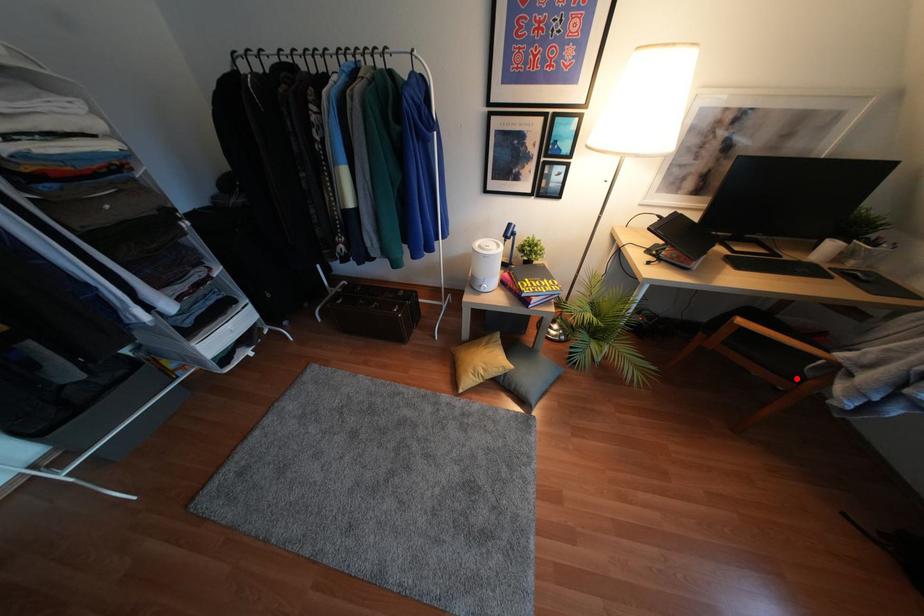
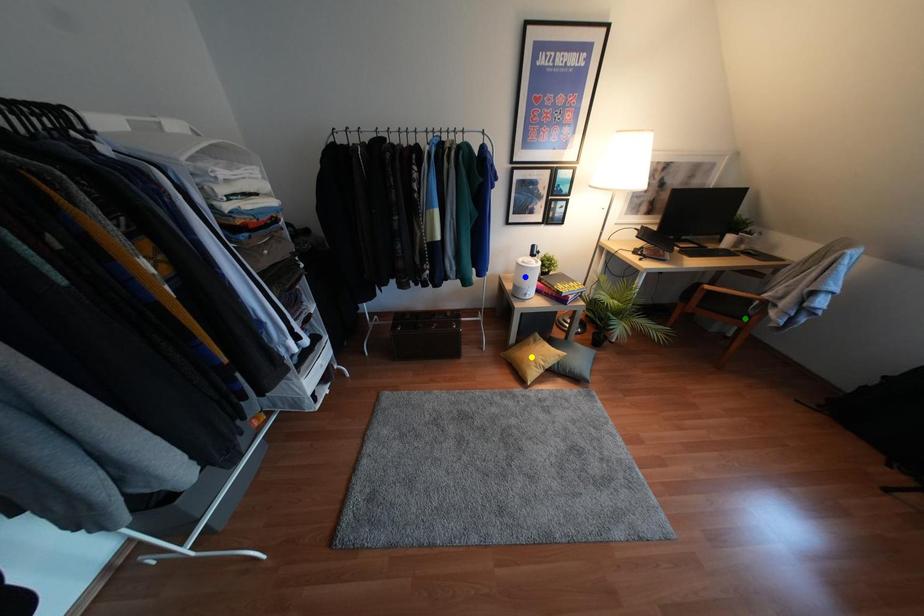
Question: I am providing you with two images of the same scene from different viewpoints. A red point is marked on the first image. You are given multiple points on the second image. Which point in image 2 represents the same 3d spot as the red point in image 1?

Choices:
 (A) yellow point
 (B) green point
 (C) blue point

Answer: (B)